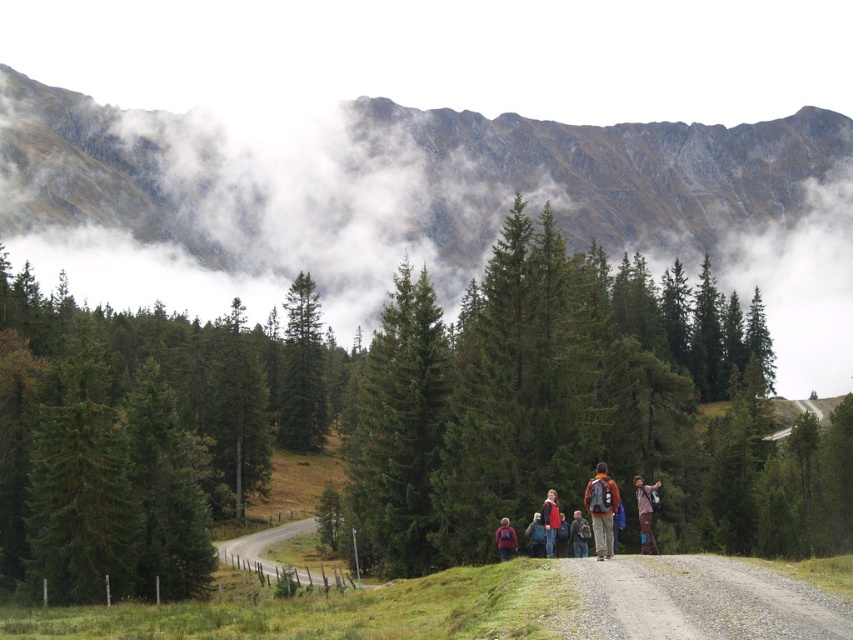
Question: Considering the real-world distances, which object is closest to the dark gray backpack at center?

Choices:
 (A) orange backpack at center
 (B) red jacket at center
 (C) green matte pine forest at center

Answer: (B)

Question: Where is green matte pine forest at center located in relation to dark blue jacket at center in the image?

Choices:
 (A) left
 (B) right

Answer: (A)

Question: Does orange fabric backpack at center come behind matte purple backpack at center?

Choices:
 (A) yes
 (B) no

Answer: (B)

Question: In this image, where is orange backpack at center located relative to orange fabric backpack at center?

Choices:
 (A) above
 (B) below

Answer: (B)

Question: Which point appears closest to the camera in this image?

Choices:
 (A) (556, 528)
 (B) (289, 300)
 (C) (514, 538)

Answer: (A)

Question: Which object is positioned closest to the dark blue jacket at center?

Choices:
 (A) dark gray backpack at center
 (B) orange fabric backpack at center

Answer: (A)